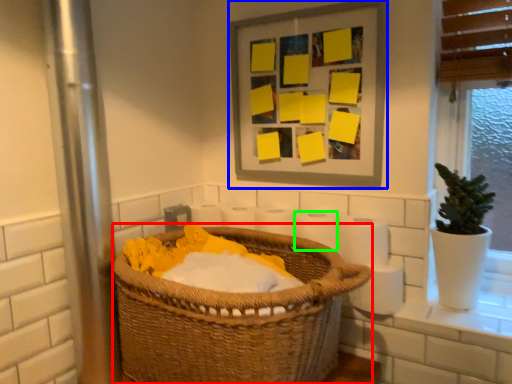
Question: Which object is positioned closest to basket (highlighted by a red box)? Select from picture frame (highlighted by a blue box) and toilet paper (highlighted by a green box).

Choices:
 (A) picture frame
 (B) toilet paper

Answer: (B)